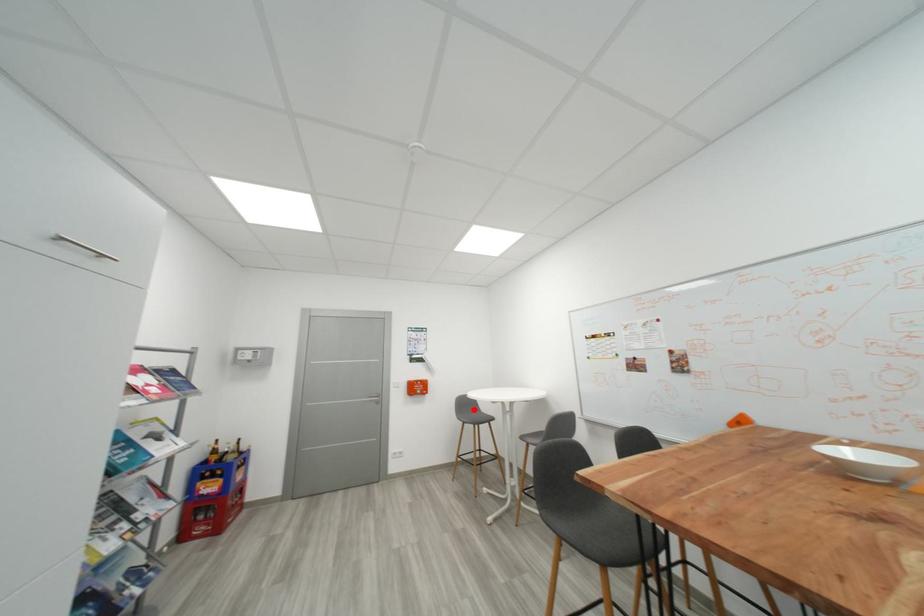
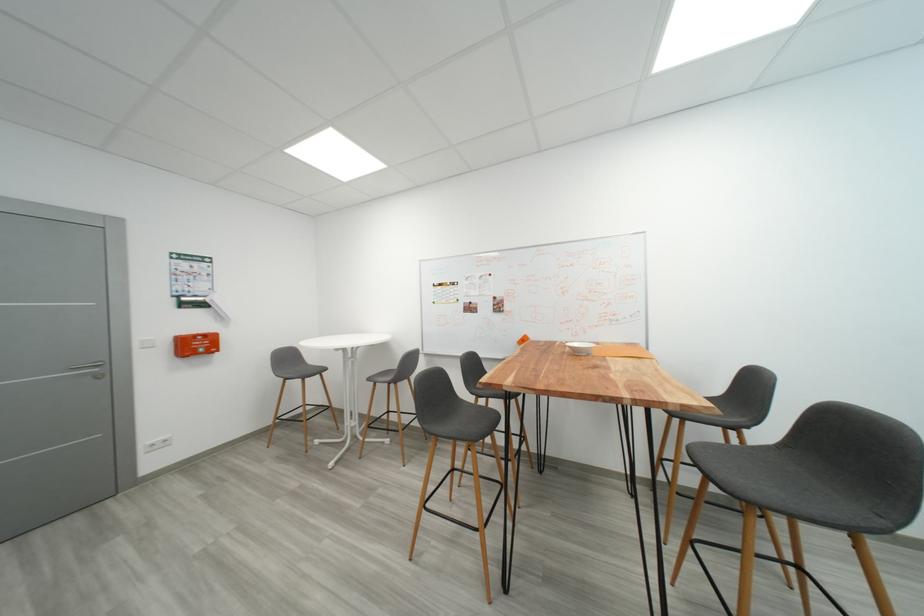
Question: I am providing you with two images of the same scene from different viewpoints. Image1 has a red point marked. In image2, the corresponding 3D location appears at what relative position? Reply with the corresponding letter.

Choices:
 (A) Closer
 (B) Farther

Answer: (A)